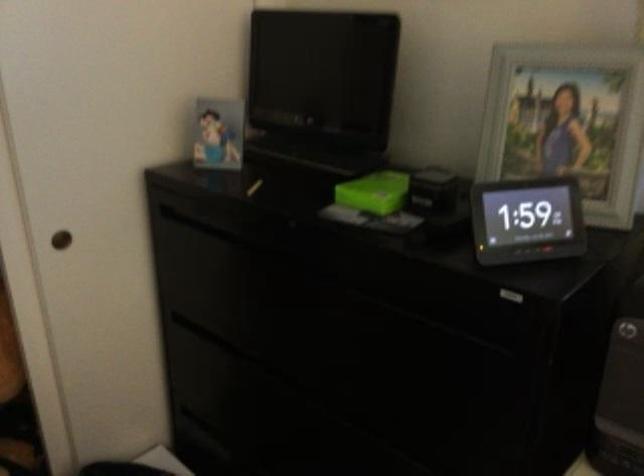
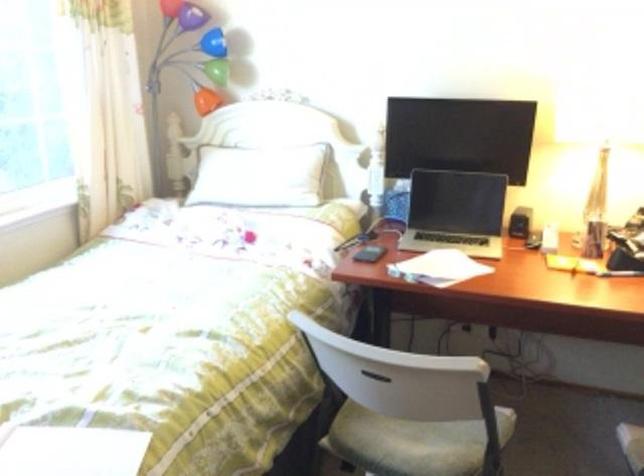
The images are taken continuously from a first-person perspective. In which direction is your viewpoint rotating?

The rotation direction of the camera is right-down.